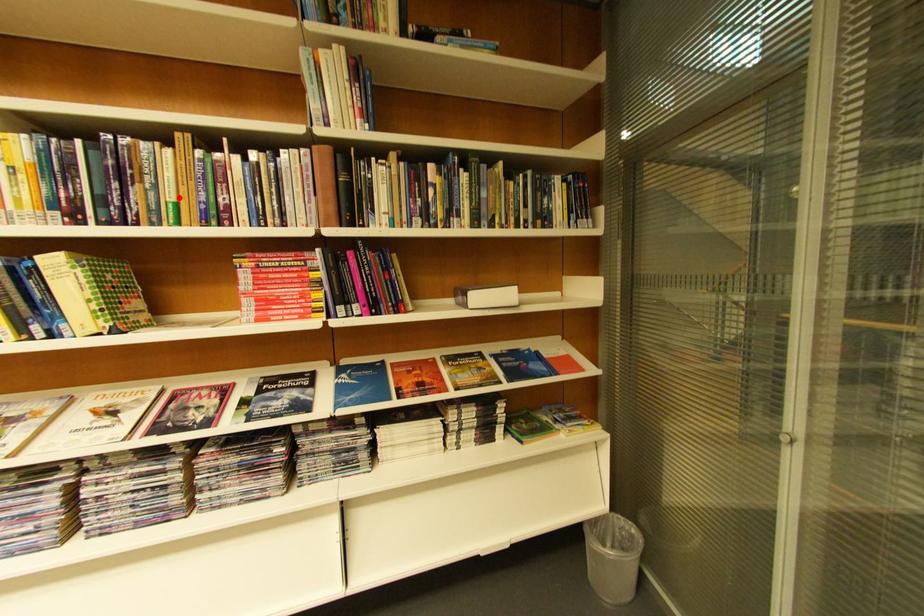
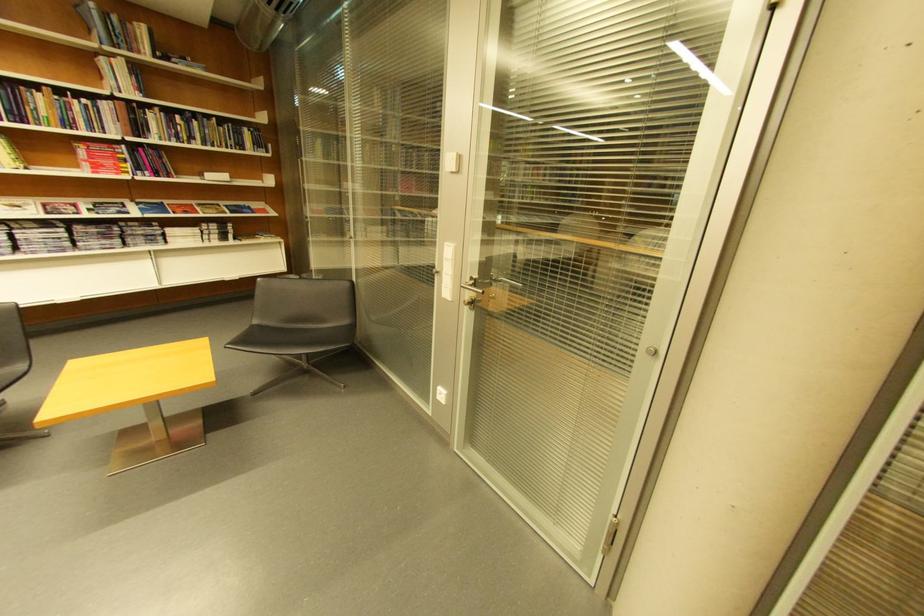
Question: I am providing you with two images of the same scene from different viewpoints. Given a red point in image1, look at the same physical point in image2. Is it:

Choices:
 (A) Closer to the viewpoint
 (B) Farther from the viewpoint

Answer: (B)